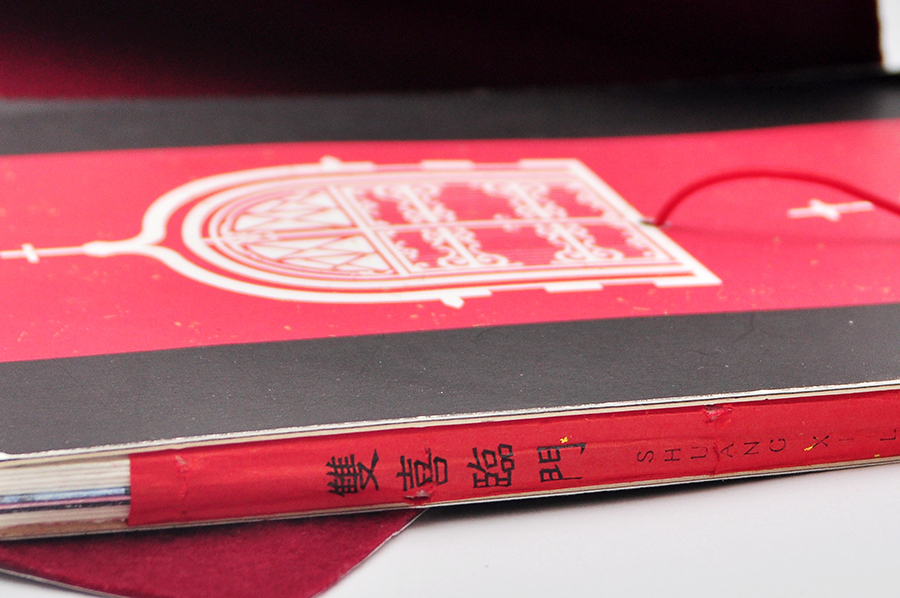
Find the location of a particular element. The width and height of the screenshot is (900, 598). tabletop is located at coordinates (718, 581).